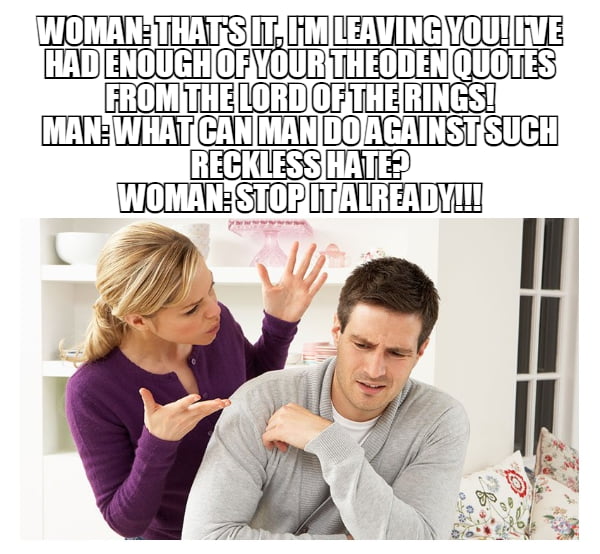
Identify the location of floral pillow. (503, 506).